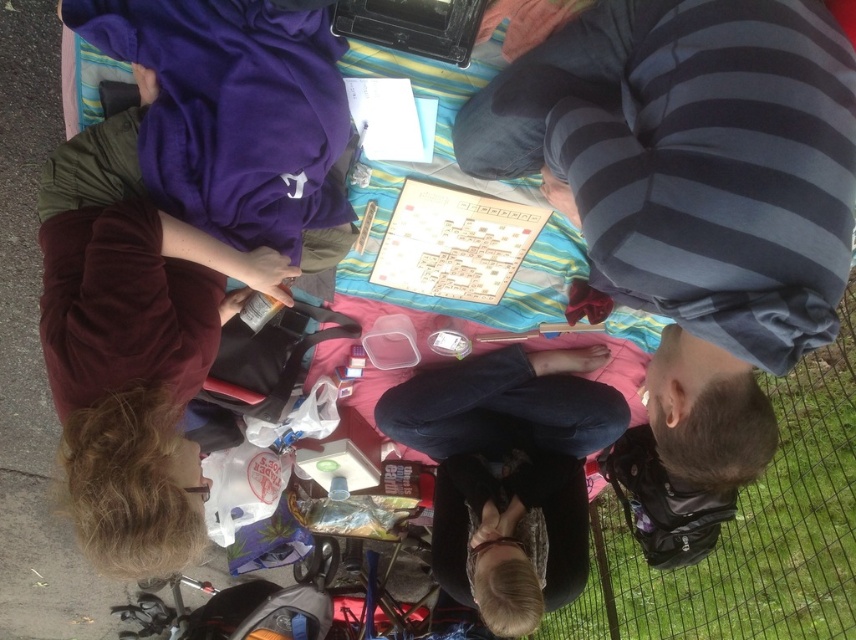
Question: Does dark blue jeans at center appear on the left side of wooden picnic table at center?

Choices:
 (A) yes
 (B) no

Answer: (B)

Question: Among these objects, which one is farthest from the camera?

Choices:
 (A) striped cotton shirt at upper right
 (B) wooden picnic table at center
 (C) dark blue jeans at center

Answer: (B)

Question: Can you confirm if striped cotton shirt at upper right is positioned to the left of dark blue jeans at center?

Choices:
 (A) yes
 (B) no

Answer: (B)

Question: Where is maroon velvet sweater at left located in relation to wooden picnic table at center in the image?

Choices:
 (A) above
 (B) below

Answer: (A)

Question: Estimate the real-world distances between objects in this image. Which object is closer to the striped cotton shirt at upper right?

Choices:
 (A) wooden picnic table at center
 (B) dark blue jeans at center
 (C) maroon velvet sweater at left

Answer: (C)

Question: Considering the real-world distances, which object is closest to the dark blue jeans at center?

Choices:
 (A) wooden picnic table at center
 (B) striped cotton shirt at upper right
 (C) maroon velvet sweater at left

Answer: (B)